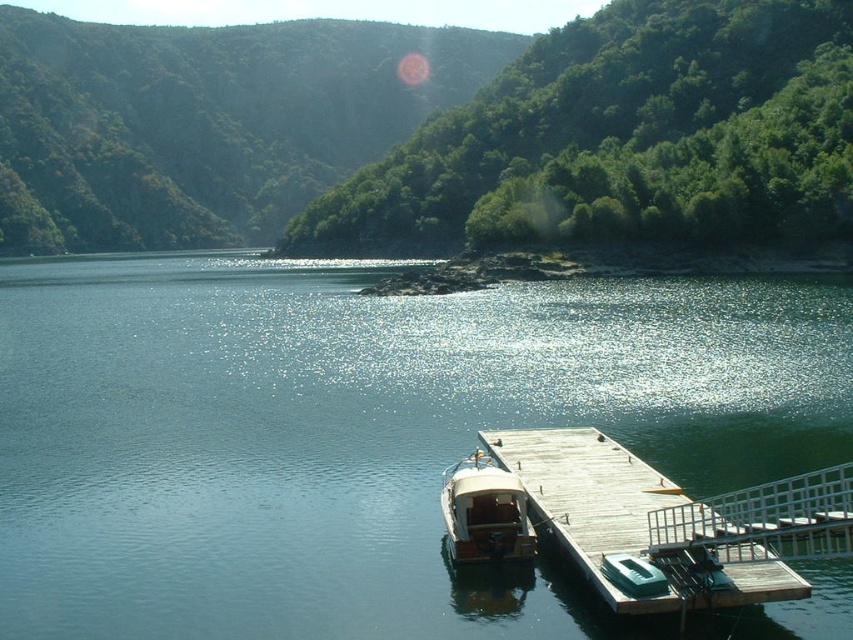
You are standing on the wooden dock and want to locate the clear blue water at center. According to the coordinates provided, in which direction should you look to see it?

The clear blue water at center is located at coordinates point (358, 433). Since coordinates typically start from the bottom left corner, the x value of 0.678 indicates a position to the right, and the y value of 0.421 indicates a position above. Therefore, you should look towards the upper right direction from your current position on the dock to see the clear blue water at center.

You are standing at the edge of the lakeside and want to determine which of the two points, point (770, 596) or point (514, 532), is nearer to you. Based on the scene, which point is closer?

Point (770, 596) is closer to the viewer than point (514, 532).

You are standing on the wooden dock at lower right and want to board the wooden polished boat at center. Which direction should you move to reach the boat?

The wooden dock at lower right is in front of the wooden polished boat at center, so you should move forward to reach the boat.